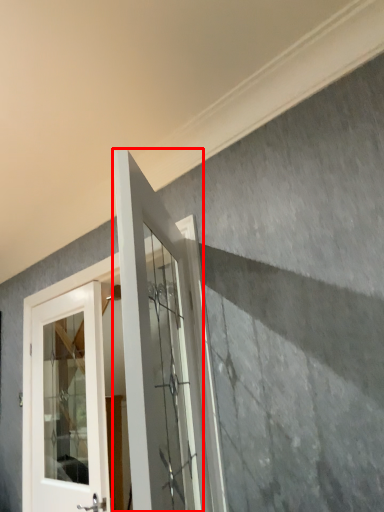
Question: Where is door (annotated by the red box) located in relation to door in the image?

Choices:
 (A) right
 (B) left

Answer: (A)